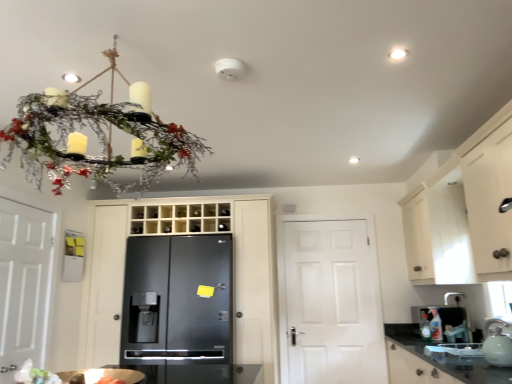
Where is `free location above white matte door at center, marked as the 3th door in a left-to-right arrangement (from a real-world perspective)`? free location above white matte door at center, marked as the 3th door in a left-to-right arrangement (from a real-world perspective) is located at coordinates (323, 225).